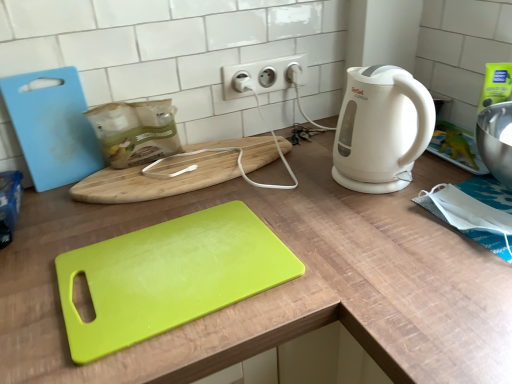
Identify the location of vacant space in front of light blue plastic cutting board at left, marked as the second cutting board in a back-to-front arrangement. (55, 222).